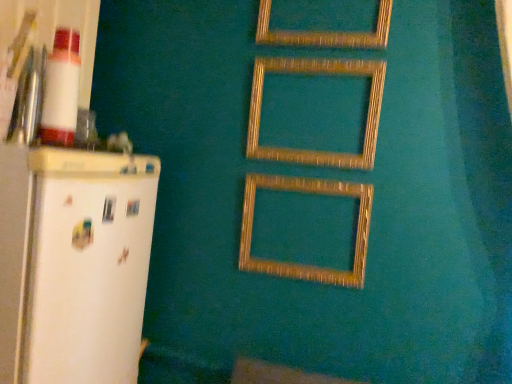
Question: Is gold textured frame at upper center, which is the 3th picture frame in bottom-to-top order, at the right side of white matte refrigerator at left?

Choices:
 (A) yes
 (B) no

Answer: (A)

Question: Is gold textured frame at upper center, which is the 3th picture frame in bottom-to-top order, turned away from white matte refrigerator at left?

Choices:
 (A) no
 (B) yes

Answer: (A)

Question: Can you confirm if gold textured frame at upper center, the 1th picture frame when ordered from top to bottom, is wider than white matte refrigerator at left?

Choices:
 (A) no
 (B) yes

Answer: (A)

Question: Could you tell me if gold textured frame at upper center, the 1th picture frame when ordered from top to bottom, is turned towards white matte refrigerator at left?

Choices:
 (A) no
 (B) yes

Answer: (A)

Question: Considering the relative positions of gold textured frame at upper center, the 1th picture frame when ordered from top to bottom, and white matte refrigerator at left in the image provided, is gold textured frame at upper center, the 1th picture frame when ordered from top to bottom, behind white matte refrigerator at left?

Choices:
 (A) no
 (B) yes

Answer: (B)

Question: From a real-world perspective, is gold textured frame at upper center, which is the 3th picture frame in bottom-to-top order, physically below white matte refrigerator at left?

Choices:
 (A) yes
 (B) no

Answer: (B)

Question: Considering the relative sizes of gold textured picture frame at center, the first picture frame ordered from the bottom, and wooden frame at center, which is counted as the second picture frame, starting from the bottom, in the image provided, is gold textured picture frame at center, the first picture frame ordered from the bottom, shorter than wooden frame at center, which is counted as the second picture frame, starting from the bottom,?

Choices:
 (A) no
 (B) yes

Answer: (B)

Question: From the image's perspective, is gold textured picture frame at center, the first picture frame ordered from the bottom, under wooden frame at center, placed as the 2th picture frame when sorted from top to bottom?

Choices:
 (A) yes
 (B) no

Answer: (A)

Question: Would you say wooden frame at center, which is counted as the second picture frame, starting from the bottom, is part of gold textured picture frame at center, the first picture frame ordered from the bottom,'s contents?

Choices:
 (A) yes
 (B) no

Answer: (B)

Question: Considering the relative sizes of gold textured picture frame at center, the first picture frame ordered from the bottom, and wooden frame at center, placed as the 2th picture frame when sorted from top to bottom, in the image provided, is gold textured picture frame at center, the first picture frame ordered from the bottom, smaller than wooden frame at center, placed as the 2th picture frame when sorted from top to bottom,?

Choices:
 (A) yes
 (B) no

Answer: (B)

Question: From a real-world perspective, is gold textured picture frame at center, the first picture frame ordered from the bottom, positioned over wooden frame at center, placed as the 2th picture frame when sorted from top to bottom, based on gravity?

Choices:
 (A) no
 (B) yes

Answer: (A)

Question: Are gold textured picture frame at center, the 3th picture frame when ordered from top to bottom, and wooden frame at center, which is counted as the second picture frame, starting from the bottom, far apart?

Choices:
 (A) no
 (B) yes

Answer: (A)

Question: Does gold textured picture frame at center, the first picture frame ordered from the bottom, have a larger size compared to white matte refrigerator at left?

Choices:
 (A) yes
 (B) no

Answer: (B)